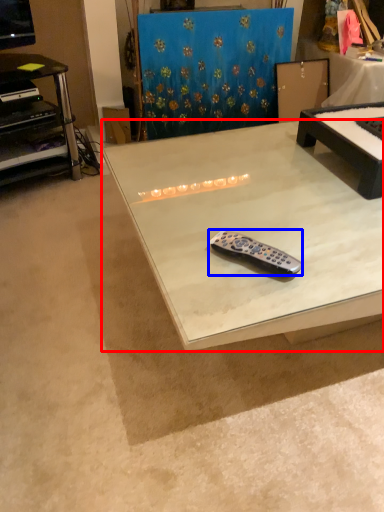
Question: Which object is further to the camera taking this photo, table (highlighted by a red box) or remote control (highlighted by a blue box)?

Choices:
 (A) table
 (B) remote control

Answer: (B)